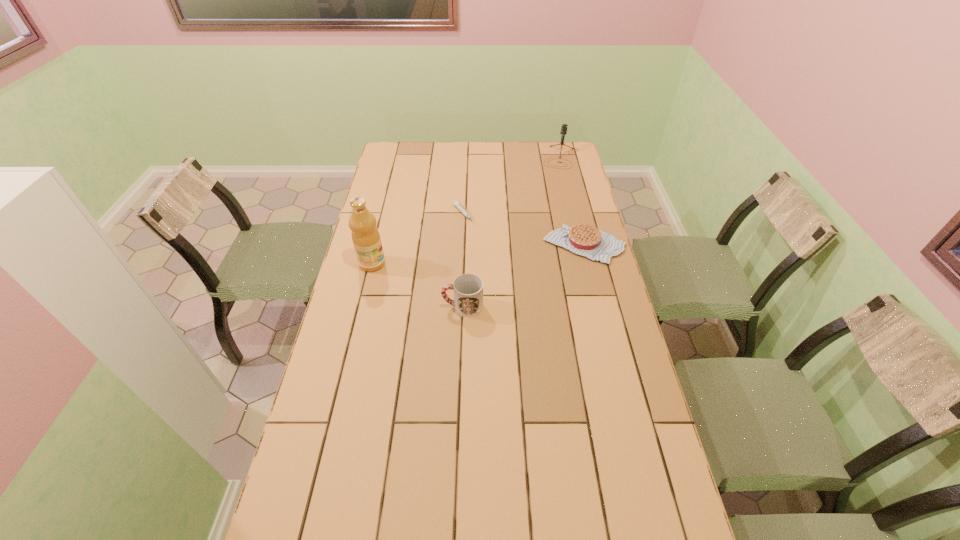
Locate an element on the screen. object at the left edge is located at coordinates (365, 235).

Locate an element on the screen. This screenshot has height=540, width=960. pie present at the right edge is located at coordinates point(586,240).

Where is `microphone positioned at the right edge`? The width and height of the screenshot is (960, 540). microphone positioned at the right edge is located at coordinates (564, 126).

You are a GUI agent. You are given a task and a screenshot of the screen. Output one action in this format:
    pyautogui.click(x=<x>, y=<y>)
    Task: Click on the object that is at the far right corner
    The image size is (960, 540).
    Given the screenshot: What is the action you would take?
    click(x=564, y=126)

At what (x,y) coordinates should I click in order to perform the action: click on free space at the far edge of the desktop. Please return your answer as a coordinate pair (x, y). Looking at the image, I should click on (453, 149).

At what (x,y) coordinates should I click in order to perform the action: click on free region at the near edge. Please return your answer as a coordinate pair (x, y). Looking at the image, I should click on (511, 498).

Find the location of a particular element. This screenshot has height=540, width=960. blank space at the left edge of the desktop is located at coordinates (382, 217).

Locate an element on the screen. Image resolution: width=960 pixels, height=540 pixels. free region at the right edge is located at coordinates coord(603,365).

Where is `free space at the far left corner`? free space at the far left corner is located at coordinates (395, 151).

You are a GUI agent. You are given a task and a screenshot of the screen. Output one action in this format:
    pyautogui.click(x=<x>, y=<y>)
    Task: Click on the free space between the shortest object and the fourth tallest object
    The image size is (960, 540).
    Given the screenshot: What is the action you would take?
    pyautogui.click(x=524, y=230)